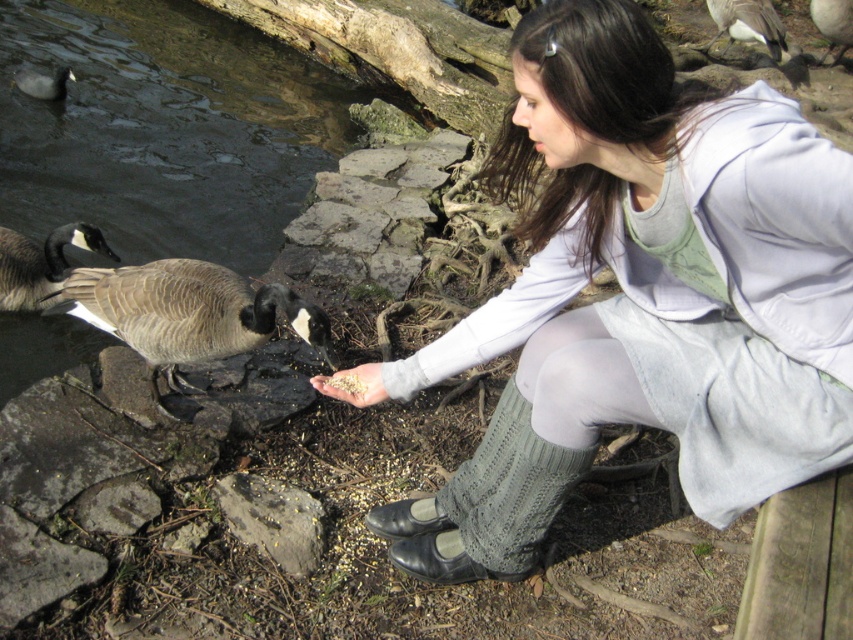
Question: Which object is farther from the camera taking this photo?

Choices:
 (A) light brown textured hand at center
 (B) dark gray matte goose at upper left
 (C) brown feathered duck at upper center

Answer: (C)

Question: Can you confirm if light brown textured hand at center is bigger than white matte duck at upper right?

Choices:
 (A) no
 (B) yes

Answer: (A)

Question: Which point is farther to the camera?

Choices:
 (A) white matte duck at upper right
 (B) light gray sweater at center

Answer: (A)

Question: Is gray feathered goose at left thinner than white matte duck at upper right?

Choices:
 (A) no
 (B) yes

Answer: (B)

Question: Which of the following is the closest to the observer?

Choices:
 (A) white matte duck at upper right
 (B) gray rough rock at lower center

Answer: (B)

Question: Does brown feathered duck at left appear on the left side of gray feathered goose at left?

Choices:
 (A) no
 (B) yes

Answer: (A)